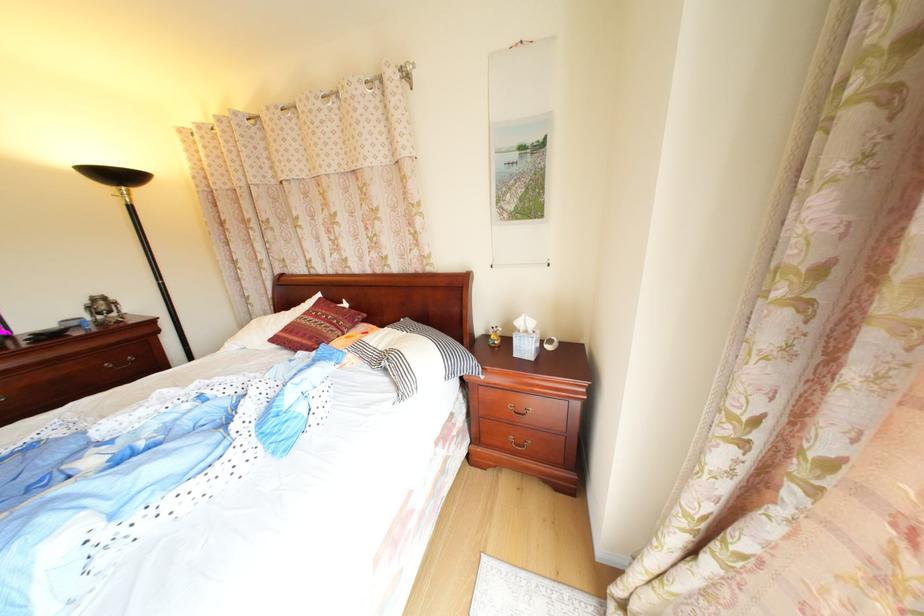
This screenshot has width=924, height=616. What are the coordinates of `striped pillow` in the screenshot? It's located at (415, 355).